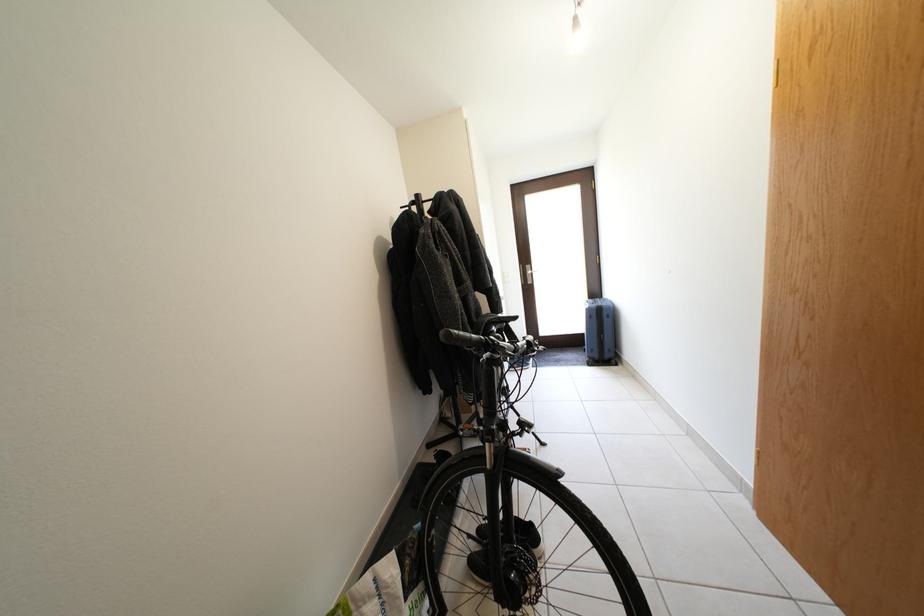
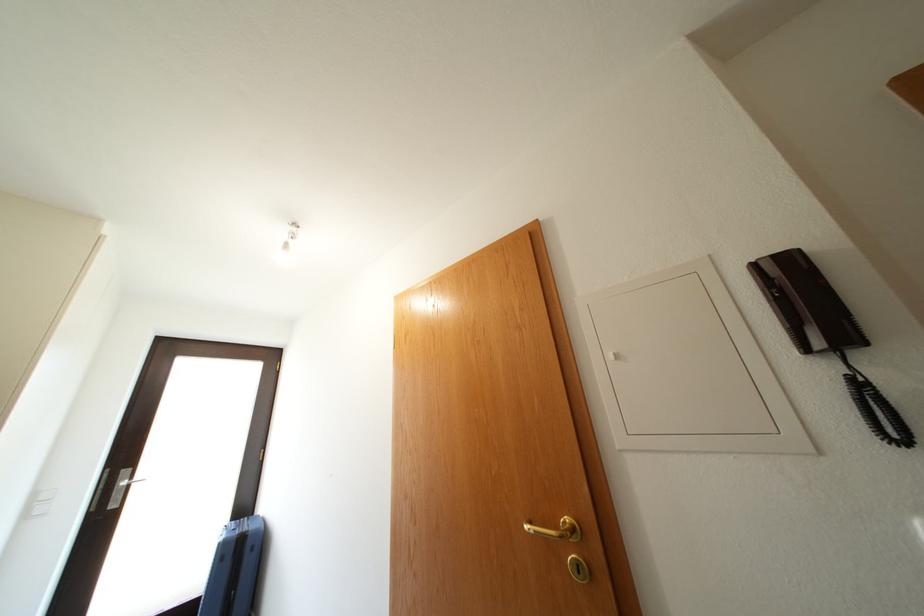
In the second image, find the point that corresponds to the point at 513,286 in the first image.

(33, 522)